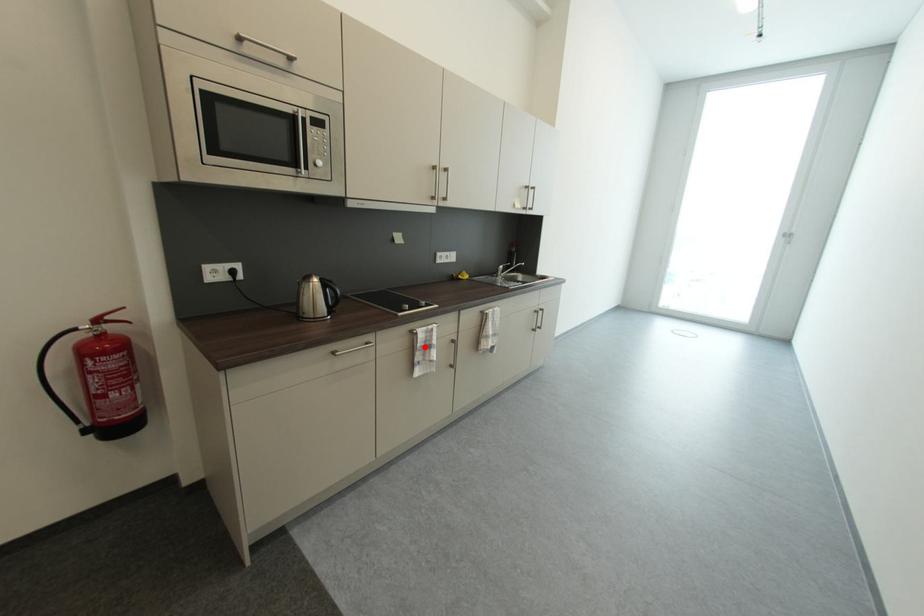
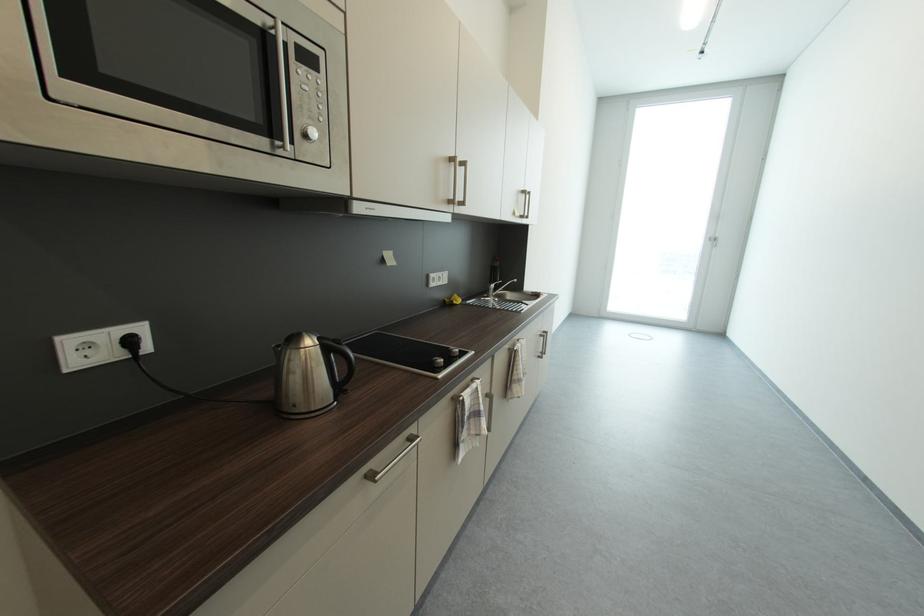
The point at the highlighted location is marked in the first image. Where is the corresponding point in the second image?

(472, 419)